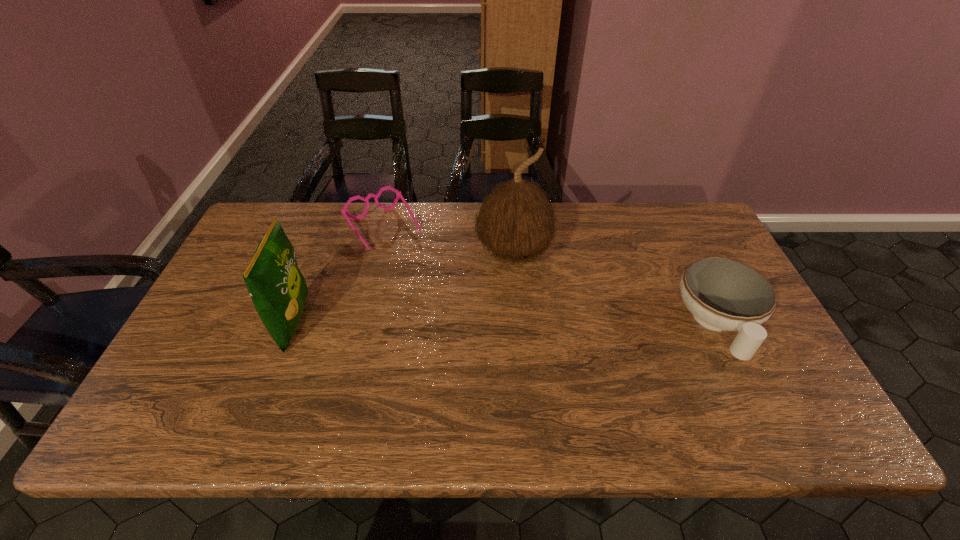
The height and width of the screenshot is (540, 960). I want to click on free space located 0.200m on the surface of the tallest object, so click(x=560, y=332).

Where is `vacant space positioned 0.060m on the arms of the spectacles`? vacant space positioned 0.060m on the arms of the spectacles is located at coordinates (406, 263).

Where is `vacant space situated on the arms of the spectacles`? This screenshot has height=540, width=960. vacant space situated on the arms of the spectacles is located at coordinates (442, 314).

Locate an element on the screen. free region located on the arms of the spectacles is located at coordinates (x=433, y=302).

The width and height of the screenshot is (960, 540). What are the coordinates of `coconut at the far edge` in the screenshot? It's located at (515, 222).

Locate an element on the screen. spectacles located in the far edge section of the desktop is located at coordinates (344, 212).

Identify the location of object at the near edge. Image resolution: width=960 pixels, height=540 pixels. (722, 294).

Locate an element on the screen. This screenshot has width=960, height=540. object located in the right edge section of the desktop is located at coordinates [x=722, y=294].

Locate an element on the screen. Image resolution: width=960 pixels, height=540 pixels. object present at the near right corner is located at coordinates (722, 294).

At what (x,y) coordinates should I click in order to perform the action: click on vacant region at the far edge of the desktop. Please return your answer as a coordinate pair (x, y). Looking at the image, I should click on (422, 229).